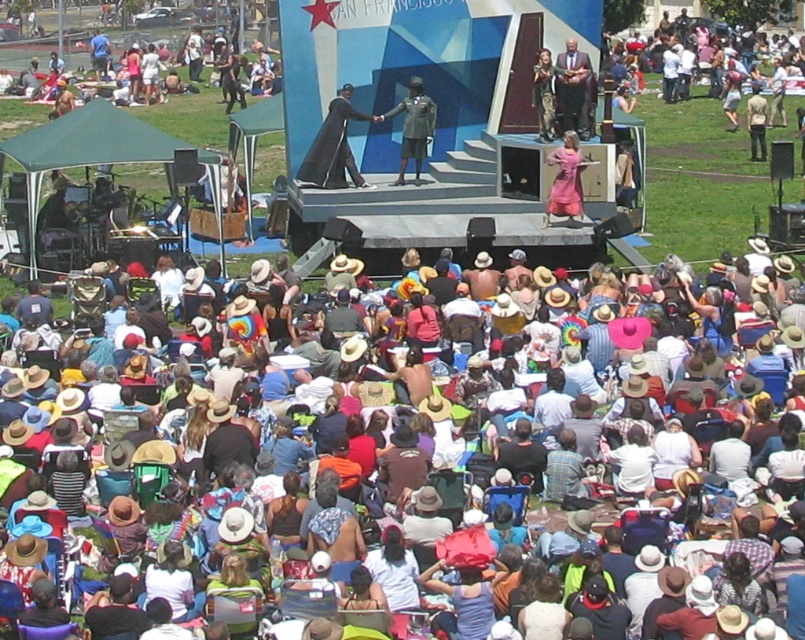
Does brown straw hats at center have a greater height compared to metallic silver statue at center?

Yes.

Can you confirm if brown straw hats at center is smaller than metallic silver statue at center?

No, brown straw hats at center is not smaller than metallic silver statue at center.

This screenshot has width=805, height=640. In order to click on brown straw hats at center in this screenshot , I will do pyautogui.click(x=694, y=420).

Which is more to the right, metallic silver statue at center or smooth brown suit at center?

smooth brown suit at center is more to the right.

Does metallic silver statue at center have a smaller size compared to smooth brown suit at center?

Actually, metallic silver statue at center might be larger than smooth brown suit at center.

What do you see at coordinates (413, 128) in the screenshot? I see `metallic silver statue at center` at bounding box center [413, 128].

At what (x,y) coordinates should I click in order to perform the action: click on metallic silver statue at center. Please return your answer as a coordinate pair (x, y). Image resolution: width=805 pixels, height=640 pixels. Looking at the image, I should click on (413, 128).

Based on the photo, does black matte robe at center have a greater width compared to metallic silver statue at center?

No, black matte robe at center is not wider than metallic silver statue at center.

Is point (308, 156) positioned behind point (395, 109)?

No, (308, 156) is in front of (395, 109).

The width and height of the screenshot is (805, 640). I want to click on black matte robe at center, so click(333, 147).